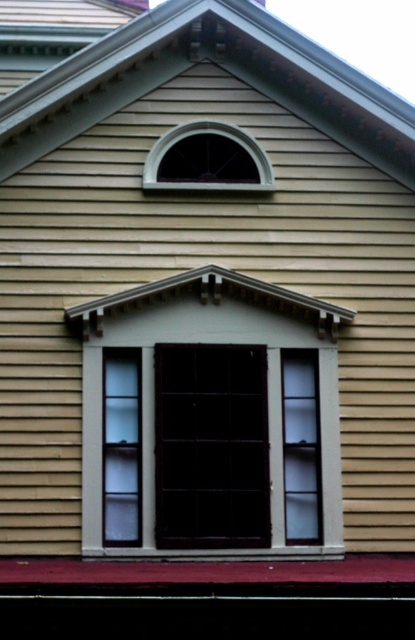
You are an architect designing a model of this building facade. You need to ensure that the matte gray window at center and the matte gray window at upper center are proportionally accurate. Which window should have a wider frame in your model?

The matte gray window at center has a larger width than the matte gray window at upper center, so the matte gray window at center should have a wider frame in the model.

You are standing in front of the building facade shown in the image. There is a matte gray window at center. Can you determine the location of the point with coordinates (x=209, y=420) relative to the matte gray window at center?

The point with coordinates (x=209, y=420) is located at the center of the matte gray window at center.

You are standing in front of the building and notice two matte gray windows. According to the scene, which window is closer to you, the matte gray window at center or the matte gray window at upper center?

The matte gray window at center is closer because it is in front of the matte gray window at upper center.